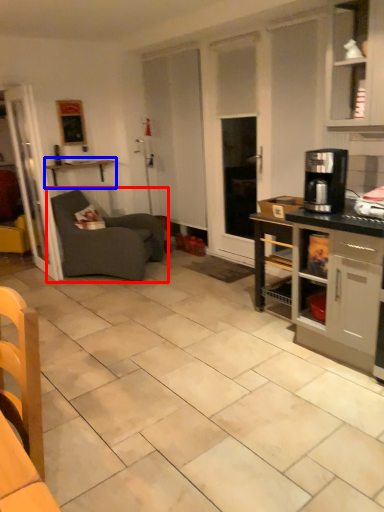
Question: Which object is further to the camera taking this photo, studio couch (highlighted by a red box) or shelf (highlighted by a blue box)?

Choices:
 (A) studio couch
 (B) shelf

Answer: (B)